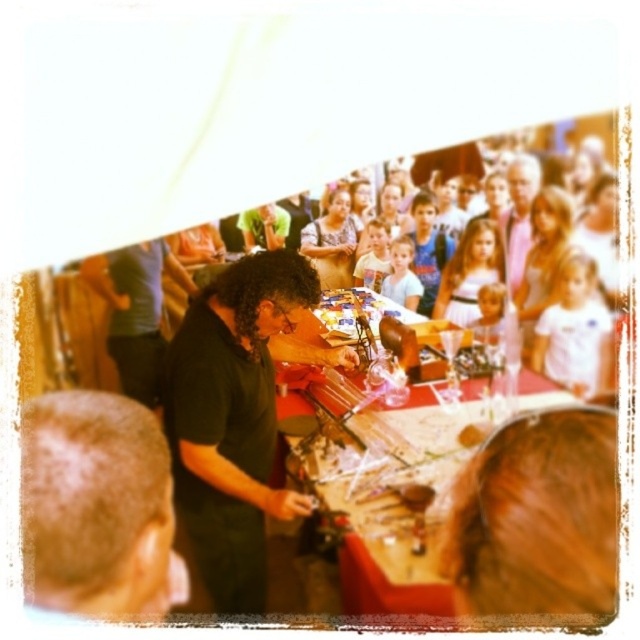
You are at the fair and want to locate the person with the gray hair at lower left. Which direction should you look relative to the matte gray shirt at upper center?

The gray hair at lower left is to the left of the matte gray shirt at upper center, so you should look to the left of the matte gray shirt at upper center to find the gray hair at lower left.